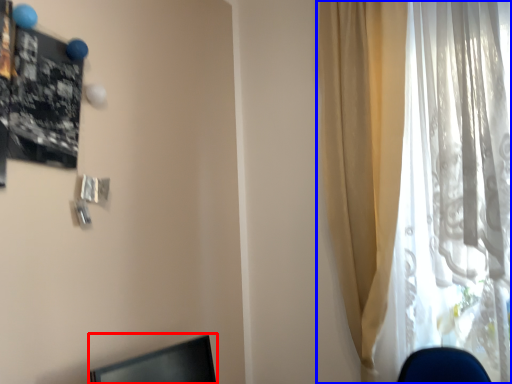
Question: Which object appears farthest to the camera in this image, desktop (highlighted by a red box) or curtain (highlighted by a blue box)?

Choices:
 (A) desktop
 (B) curtain

Answer: (B)